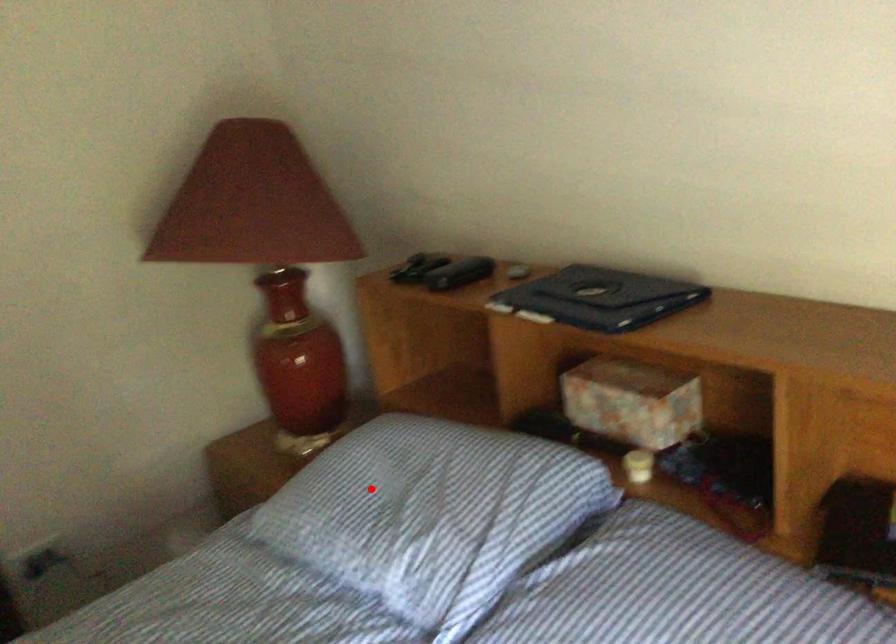
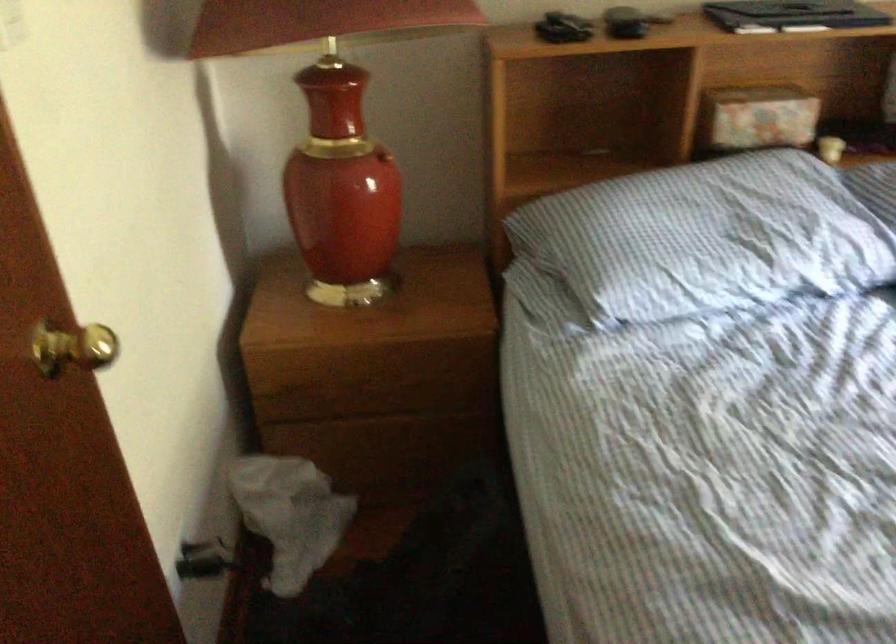
In the second image, find the point that corresponds to the highlighted location in the first image.

(707, 238)